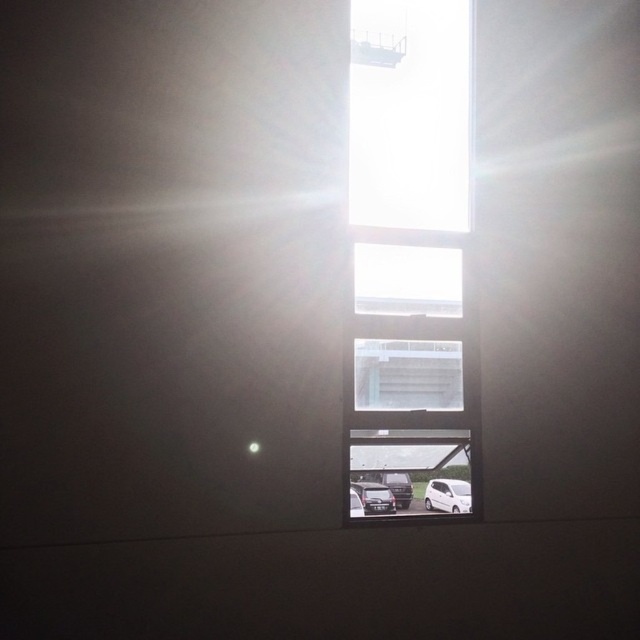
Who is positioned more to the left, white matte van at lower center or shiny silver car at bottom center?

shiny silver car at bottom center is more to the left.

Between white matte van at lower center and shiny silver car at bottom center, which one appears on the right side from the viewer's perspective?

white matte van at lower center

Where is `white matte van at lower center`? white matte van at lower center is located at coordinates (448, 496).

Find the location of `white matte van at lower center`. white matte van at lower center is located at coordinates (448, 496).

Describe the element at coordinates (448, 496) in the screenshot. I see `white matte van at lower center` at that location.

Image resolution: width=640 pixels, height=640 pixels. What are the coordinates of `white matte van at lower center` in the screenshot? It's located at (448, 496).

Does point (440, 246) come behind point (432, 493)?

No, it is not.

Who is more forward, [401,465] or [452,499]?

Positioned in front is point [401,465].

You are a GUI agent. You are given a task and a screenshot of the screen. Output one action in this format:
    pyautogui.click(x=<x>, y=<y>)
    Task: Click on the transparent glass window at center
    
    Given the screenshot: What is the action you would take?
    pyautogui.click(x=412, y=248)